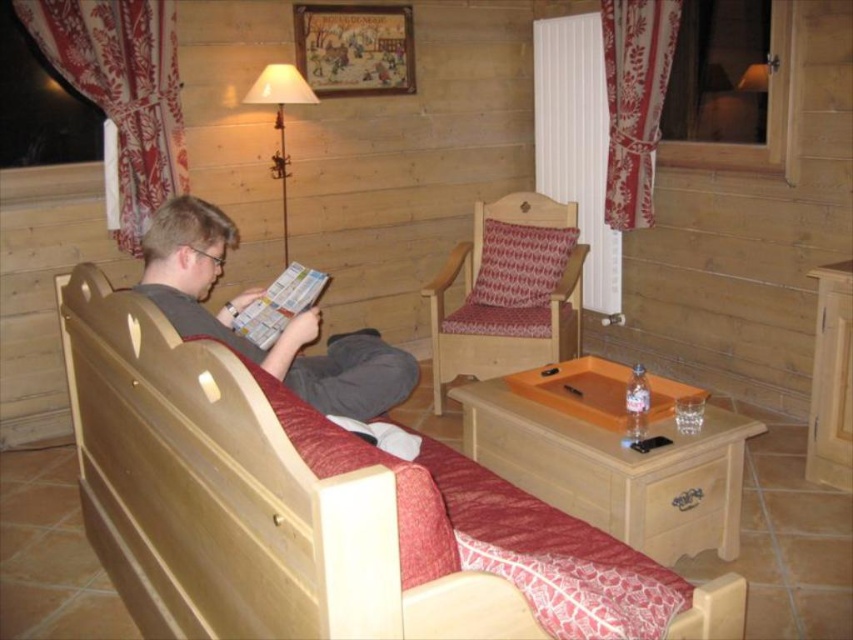
You are standing in the living room and want to place a small potted plant between the two points marked as point (216, 600) and point (293, 365). Which point should the plant be closer to in order to be nearer to the viewer?

The plant should be placed closer to point (216, 600) because it is closer to the viewer than point (293, 365).

You are a delivery robot with a package that is 50 centimeters wide. You need to navigate through the space between the wooden bed at center and the matte gray shirt at left to deliver the package. Can you fit through the space?

The distance between the wooden bed at center and the matte gray shirt at left is 45.48 centimeters. Since the package is 50 centimeters wide, it is wider than the available space. Therefore, the delivery robot cannot fit through the space between them.